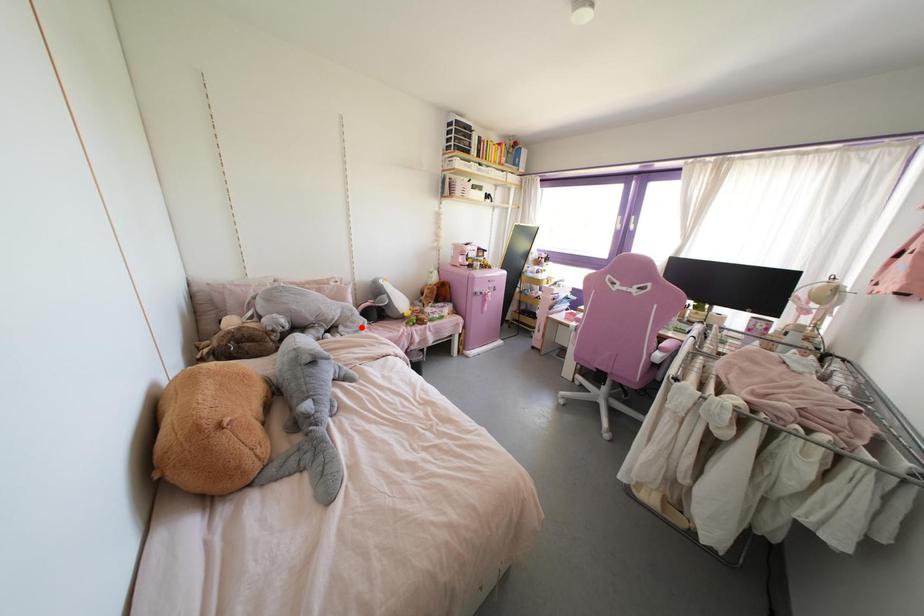
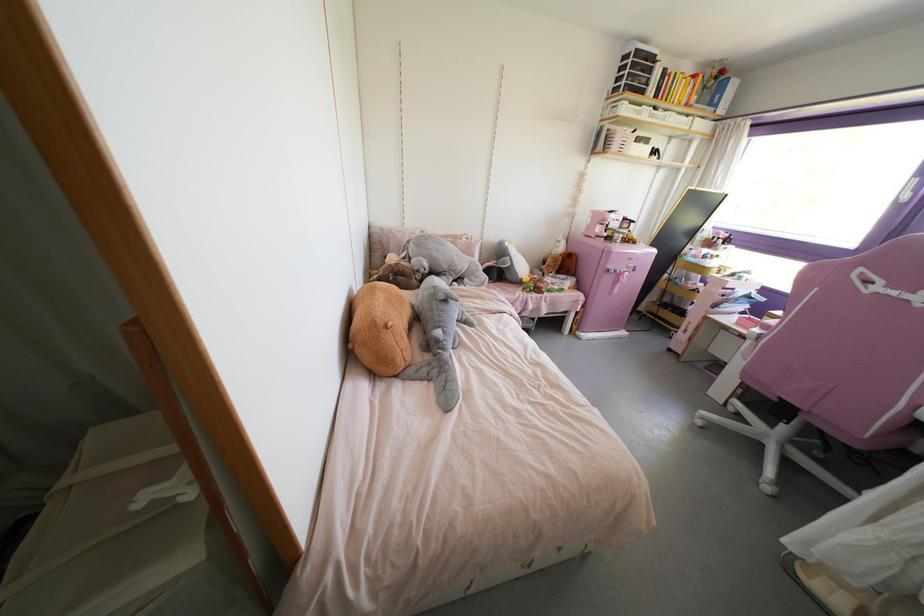
Where in the second image is the point corresponding to the highlighted location from the first image?

(482, 284)